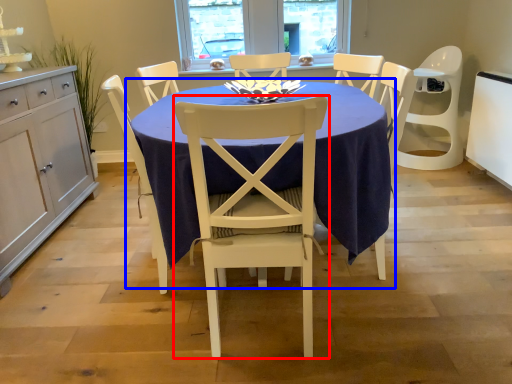
Question: Which of the following is the farthest to the observer, chair (highlighted by a red box) or kitchen & dining room table (highlighted by a blue box)?

Choices:
 (A) chair
 (B) kitchen & dining room table

Answer: (B)